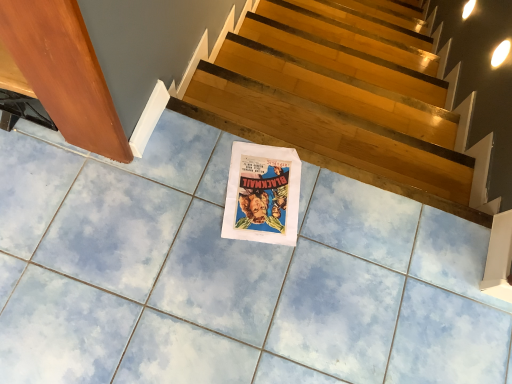
Locate an element on the screen. This screenshot has height=384, width=512. empty space that is ontop of white paper at center (from a real-world perspective) is located at coordinates (264, 193).